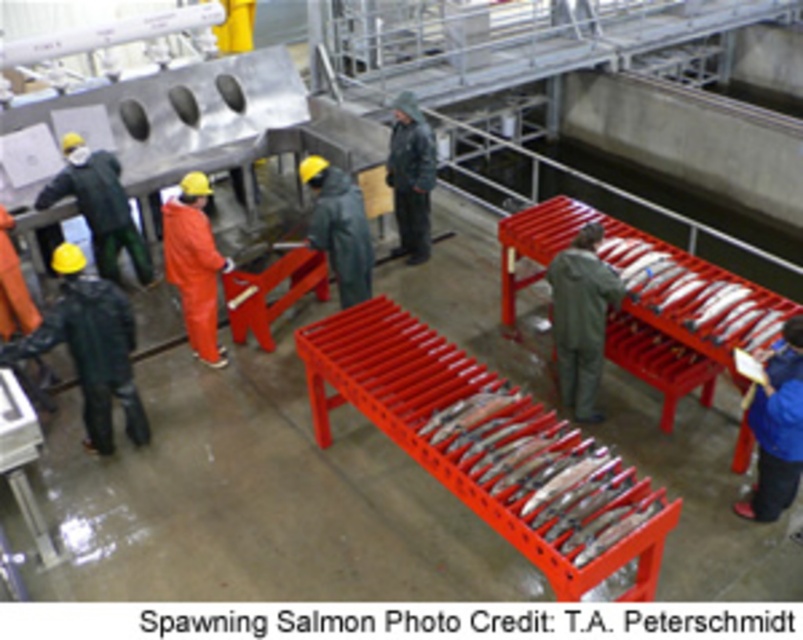
Which is above, green matte jacket at center or dark gray waterproof jacket at center?

Positioned higher is dark gray waterproof jacket at center.

Looking at this image, is green matte jacket at center smaller than dark gray waterproof jacket at center?

Yes.

Who is more distant from viewer, (x=336, y=275) or (x=426, y=164)?

The point (x=426, y=164) is behind.

This screenshot has width=803, height=640. Find the location of `green matte jacket at center`. green matte jacket at center is located at coordinates (339, 227).

Does black rubber boots at lower left appear under blue fabric jacket at lower right?

Actually, black rubber boots at lower left is above blue fabric jacket at lower right.

Between point (113, 358) and point (785, 321), which one is positioned behind?

The point (113, 358) is more distant.

Where is `black rubber boots at lower left`? black rubber boots at lower left is located at coordinates (90, 348).

Which is above, orange matte coveralls at center or dark gray waterproof jacket at center?

dark gray waterproof jacket at center is higher up.

Find the location of a particular element. The height and width of the screenshot is (640, 803). orange matte coveralls at center is located at coordinates (194, 264).

What do you see at coordinates (194, 264) in the screenshot? Image resolution: width=803 pixels, height=640 pixels. I see `orange matte coveralls at center` at bounding box center [194, 264].

You are a GUI agent. You are given a task and a screenshot of the screen. Output one action in this format:
    pyautogui.click(x=<x>, y=<y>)
    Task: Click on the orange matte coveralls at center
    The image size is (803, 640).
    Given the screenshot: What is the action you would take?
    pyautogui.click(x=194, y=264)